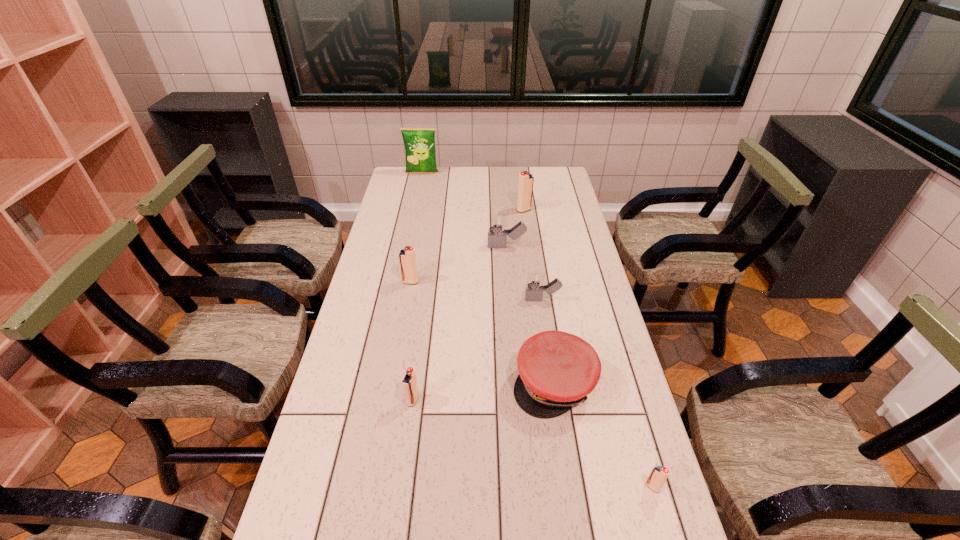
Find the location of `the farthest object`. the farthest object is located at coordinates (419, 143).

At what (x,y) coordinates should I click in order to perform the action: click on crisp (potato chip). Please return your answer as a coordinate pair (x, y). Looking at the image, I should click on (419, 143).

Where is `the second tallest object`? Image resolution: width=960 pixels, height=540 pixels. the second tallest object is located at coordinates (525, 186).

You are a GUI agent. You are given a task and a screenshot of the screen. Output one action in this format:
    pyautogui.click(x=<x>, y=<y>)
    Task: Click on the farthest igniter
    This screenshot has width=960, height=540.
    Given the screenshot: What is the action you would take?
    pyautogui.click(x=525, y=186)

At what (x,y) coordinates should I click in order to perform the action: click on the sixth nearest object. Please return your answer as a coordinate pair (x, y). The image size is (960, 540). Looking at the image, I should click on (407, 259).

At what (x,y) coordinates should I click in order to perform the action: click on the leftmost red igniter. Please return your answer as a coordinate pair (x, y). This screenshot has height=540, width=960. Looking at the image, I should click on [x=407, y=259].

The image size is (960, 540). I want to click on the farthest gray igniter, so click(497, 238).

Identify the location of the sixth nearest igniter. Image resolution: width=960 pixels, height=540 pixels. (497, 238).

At what (x,y) coordinates should I click in order to perform the action: click on the second biggest gray igniter. Please return your answer as a coordinate pair (x, y). Looking at the image, I should click on (535, 281).

I want to click on the fifth nearest object, so click(535, 281).